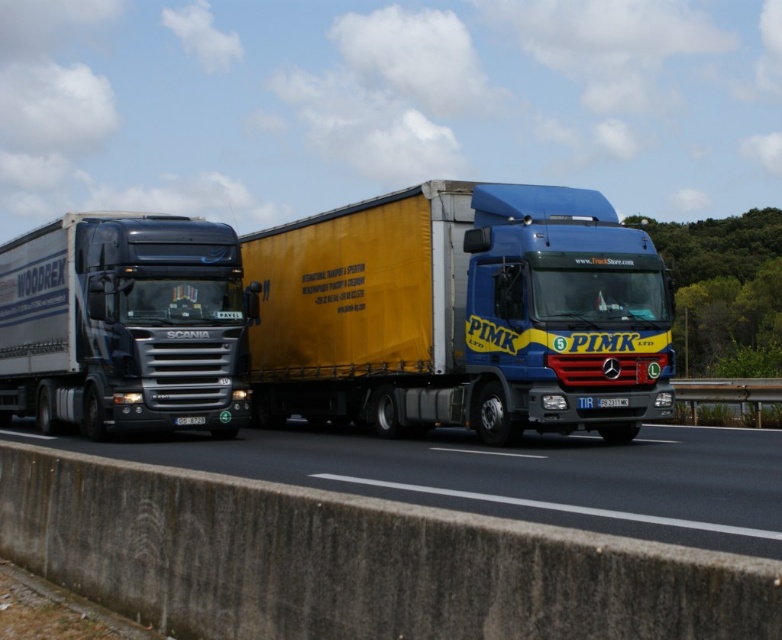
Question: Which point appears closest to the camera in this image?

Choices:
 (A) (407, 291)
 (B) (178, 260)
 (C) (732, 522)

Answer: (C)

Question: Where is metallic silver truck at left located in relation to concrete barrier at lower left in the image?

Choices:
 (A) below
 (B) above

Answer: (B)

Question: Which point appears closest to the camera in this image?

Choices:
 (A) (59, 406)
 (B) (219, 451)

Answer: (B)

Question: Is yellow matte trailer truck at center above metallic silver truck at left?

Choices:
 (A) yes
 (B) no

Answer: (A)

Question: Can you confirm if yellow matte trailer truck at center is wider than concrete barrier at lower left?

Choices:
 (A) no
 (B) yes

Answer: (A)

Question: Which point is farther from the camera taking this photo?

Choices:
 (A) (454, 228)
 (B) (544, 464)
 (C) (187, 349)

Answer: (C)